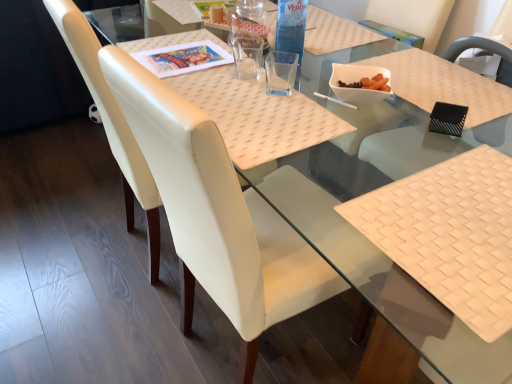
Question: Considering the relative sizes of white woven placemat at lower right and white leather chair at center, which ranks as the second chair in left-to-right order, in the image provided, is white woven placemat at lower right bigger than white leather chair at center, which ranks as the second chair in left-to-right order,?

Choices:
 (A) yes
 (B) no

Answer: (B)

Question: Is white woven placemat at lower right oriented towards white leather chair at center, which ranks as the second chair in left-to-right order?

Choices:
 (A) no
 (B) yes

Answer: (B)

Question: Does white woven placemat at lower right have a lesser width compared to white leather chair at center, which ranks as the second chair in left-to-right order?

Choices:
 (A) no
 (B) yes

Answer: (B)

Question: From the image's perspective, is white woven placemat at lower right located above white leather chair at center, which ranks as the second chair in left-to-right order?

Choices:
 (A) no
 (B) yes

Answer: (B)

Question: Would you say white woven placemat at lower right is outside white leather chair at center, acting as the 2th chair starting from the right?

Choices:
 (A) no
 (B) yes

Answer: (B)

Question: From a real-world perspective, is woven beige placemat at center above or below white woven placemat at lower right?

Choices:
 (A) above
 (B) below

Answer: (A)

Question: Considering the positions of woven beige placemat at center and white woven placemat at lower right in the image, is woven beige placemat at center taller or shorter than white woven placemat at lower right?

Choices:
 (A) tall
 (B) short

Answer: (A)

Question: Considering the positions of woven beige placemat at center and white woven placemat at lower right in the image, is woven beige placemat at center bigger or smaller than white woven placemat at lower right?

Choices:
 (A) small
 (B) big

Answer: (B)

Question: Is woven beige placemat at center in front of or behind white woven placemat at lower right in the image?

Choices:
 (A) behind
 (B) front

Answer: (A)

Question: Is white leather chair at center, acting as the 2th chair starting from the right, bigger or smaller than white woven placemat at lower right?

Choices:
 (A) big
 (B) small

Answer: (A)

Question: Is white leather chair at center, acting as the 2th chair starting from the right, taller or shorter than white woven placemat at lower right?

Choices:
 (A) short
 (B) tall

Answer: (B)

Question: Which is correct: white leather chair at center, acting as the 2th chair starting from the right, is inside white woven placemat at lower right, or outside of it?

Choices:
 (A) inside
 (B) outside

Answer: (B)

Question: Is white leather chair at center, which ranks as the second chair in left-to-right order, wider or thinner than white woven placemat at lower right?

Choices:
 (A) thin
 (B) wide

Answer: (B)

Question: Relative to black mesh chair at upper right, marked as the first chair in a right-to-left arrangement, is white woven placemat at lower right in front or behind?

Choices:
 (A) front
 (B) behind

Answer: (A)

Question: Considering the relative positions of white woven placemat at lower right and black mesh chair at upper right, the 3th chair in the left-to-right sequence, in the image provided, is white woven placemat at lower right to the left or to the right of black mesh chair at upper right, the 3th chair in the left-to-right sequence,?

Choices:
 (A) left
 (B) right

Answer: (A)